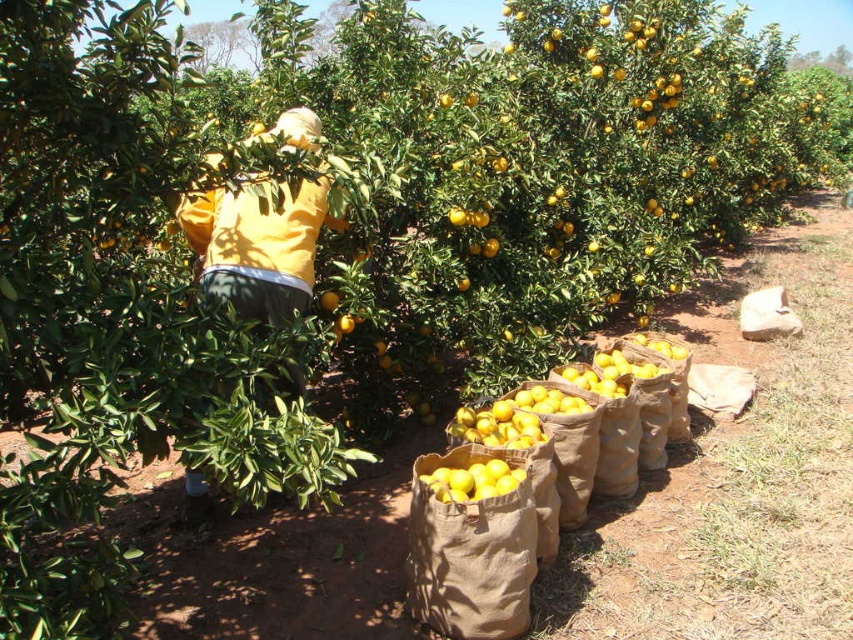
Consider the image. You are a farmer in the orange grove and you see the yellow matte jacket at center and the yellow matte bag at center. Which item is taller?

The yellow matte jacket at center is taller than the yellow matte bag at center.

You are standing at the point labeled point [254,257] and want to walk to the point labeled point [428,488]. Is there a clear path between these two points without any obstacles?

The path between point [254,257] and point [428,488] is clear since there are no obstacles mentioned in the scene description.

You are a farmer who needs to carry both the yellow matte jacket at center and the yellow matte bag at center. Which item can you carry more easily due to its size?

The yellow matte bag at center can be carried more easily because it is smaller in size compared to the yellow matte jacket at center.